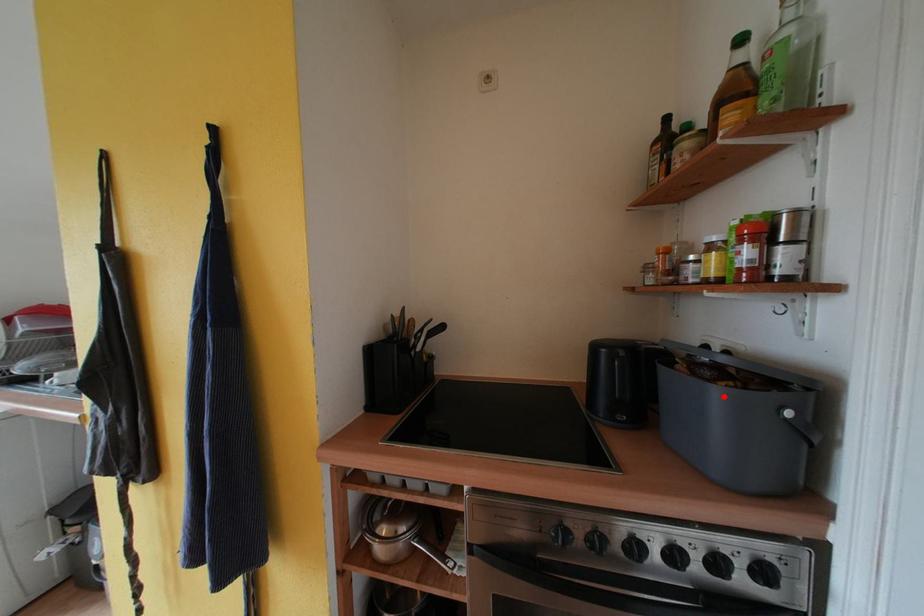
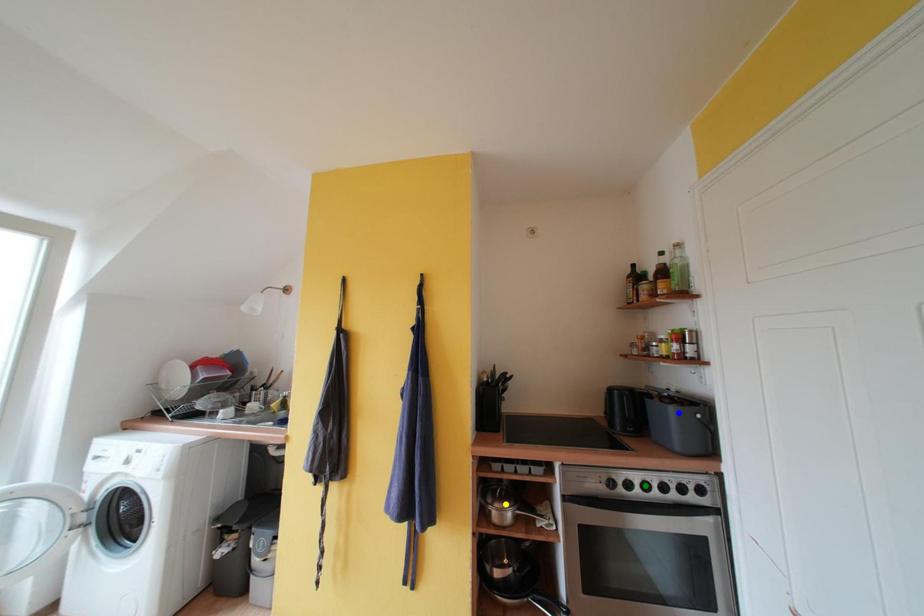
Question: I am providing you with two images of the same scene from different viewpoints. A red point is marked on the first image. You are given multiple points on the second image. Which point in image 2 is actually the same real-world point as the red point in image 1?

Choices:
 (A) yellow point
 (B) green point
 (C) blue point

Answer: (C)